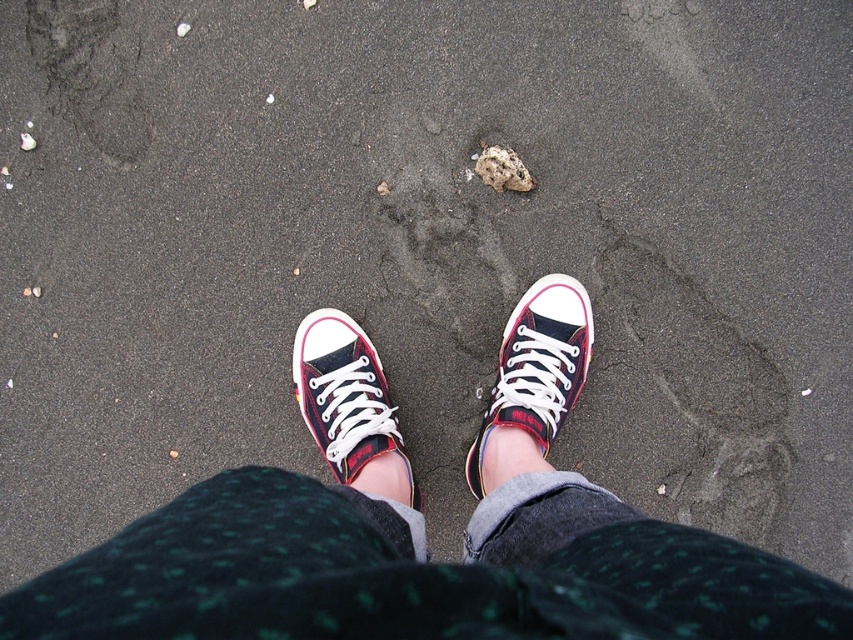
Question: Considering the real-world distances, which object is closest to the plaid canvas shoe at center?

Choices:
 (A) matte canvas sneakers at center
 (B) matte canvas sneaker at center

Answer: (A)

Question: Does matte canvas sneakers at center lie behind matte canvas sneaker at center?

Choices:
 (A) yes
 (B) no

Answer: (B)

Question: Can you confirm if matte canvas sneakers at center is bigger than plaid canvas shoe at center?

Choices:
 (A) yes
 (B) no

Answer: (A)

Question: Which of the following is the farthest from the observer?

Choices:
 (A) matte canvas sneaker at center
 (B) plaid canvas shoe at center

Answer: (B)

Question: Which of these objects is positioned closest to the plaid canvas shoe at center?

Choices:
 (A) matte canvas sneaker at center
 (B) matte canvas sneakers at center

Answer: (B)

Question: Can you confirm if plaid canvas shoe at center is positioned above matte canvas sneaker at center?

Choices:
 (A) no
 (B) yes

Answer: (B)